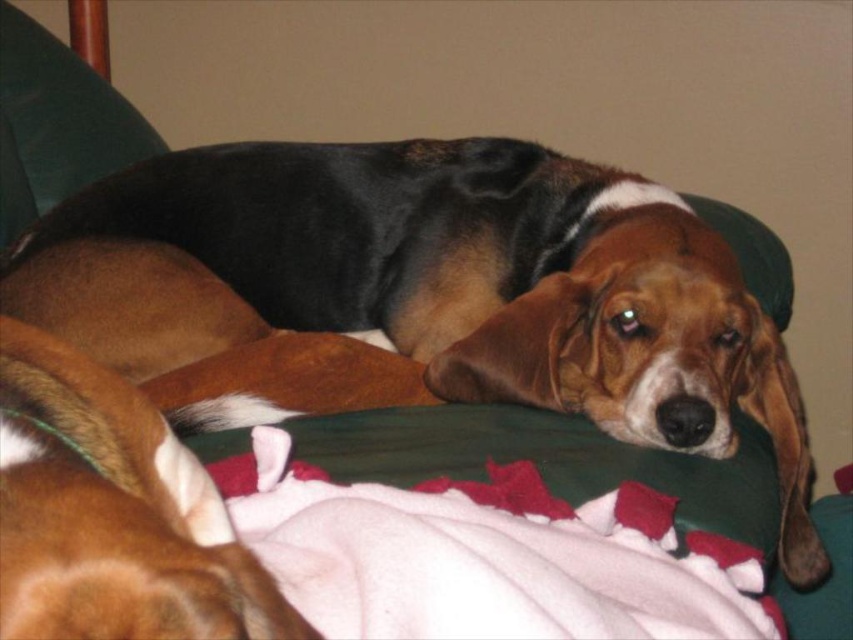
Question: Which object is farther from the camera taking this photo?

Choices:
 (A) brown furry dog at center
 (B) brown fur dog at center

Answer: (B)

Question: Among these objects, which one is nearest to the camera?

Choices:
 (A) brown fur dog at center
 (B) white fleece blanket at center

Answer: (B)

Question: Does brown fur dog at center have a lesser width compared to brown furry dog at center?

Choices:
 (A) no
 (B) yes

Answer: (A)

Question: Which point appears farthest from the camera in this image?

Choices:
 (A) (48, 449)
 (B) (613, 564)
 (C) (262, 376)

Answer: (C)

Question: Does white fleece blanket at center appear on the right side of brown furry dog at center?

Choices:
 (A) yes
 (B) no

Answer: (A)

Question: Is brown fur dog at center below brown furry dog at center?

Choices:
 (A) yes
 (B) no

Answer: (B)